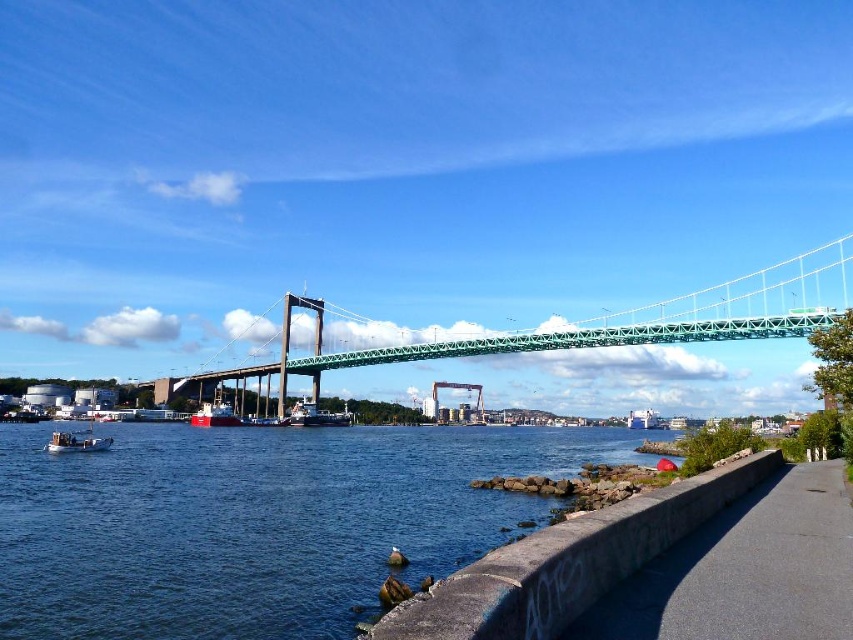
Question: Based on their relative distances, which object is farther from the white wooden boat at lower left?

Choices:
 (A) asphalt road at lower right
 (B) blue water at lower center

Answer: (A)

Question: Which point appears farthest from the camera in this image?

Choices:
 (A) (509, 452)
 (B) (51, 451)

Answer: (A)

Question: Which of the following is the closest to the observer?

Choices:
 (A) blue water at lower center
 (B) white wooden boat at lower left

Answer: (A)

Question: Does green metallic suspension bridge at center appear on the left side of white wooden boat at lower left?

Choices:
 (A) no
 (B) yes

Answer: (A)

Question: Does blue water at lower center appear under white wooden boat at lower left?

Choices:
 (A) yes
 (B) no

Answer: (A)

Question: Is blue water at lower center positioned behind white wooden boat at lower left?

Choices:
 (A) yes
 (B) no

Answer: (B)